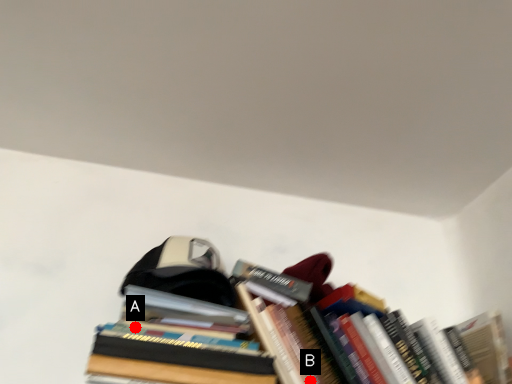
Question: Two points are circled on the image, labeled by A and B beside each circle. Which point is closer to the camera taking this photo?

Choices:
 (A) A is closer
 (B) B is closer

Answer: (B)